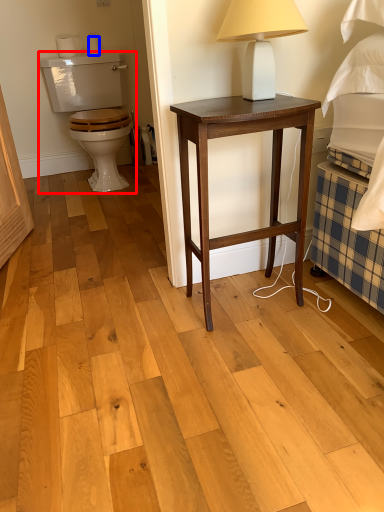
Question: Which object is closer to the camera taking this photo, armchair (highlighted by a red box) or toilet paper (highlighted by a blue box)?

Choices:
 (A) armchair
 (B) toilet paper

Answer: (A)